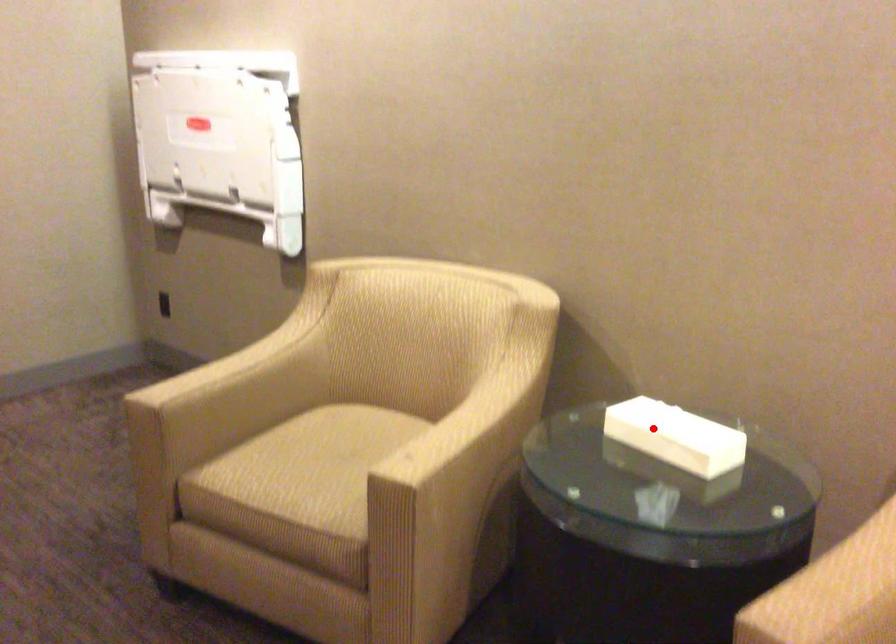
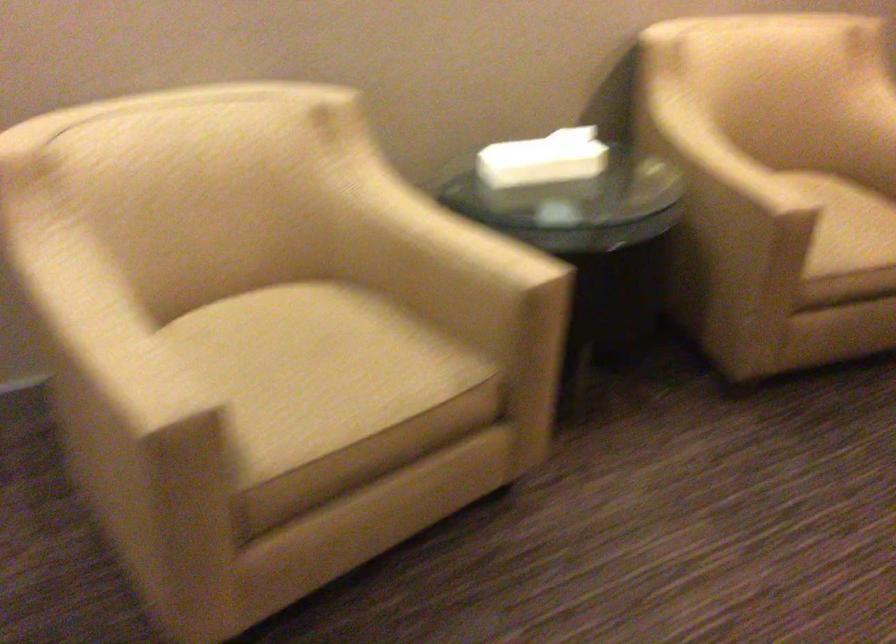
In the second image, find the point that corresponds to the highlighted location in the first image.

(543, 158)